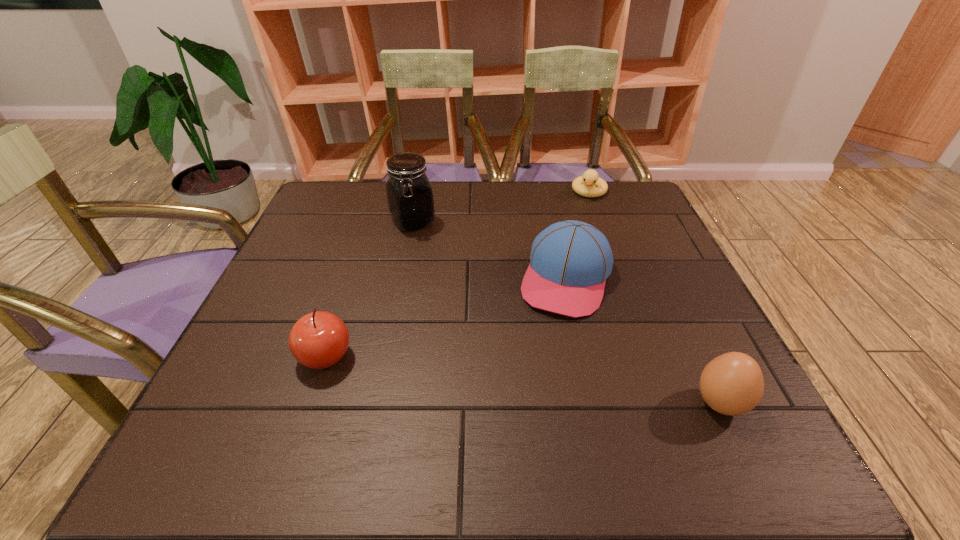
Locate an element on the screen. vacant spot on the desktop that is between the apple and the boiled egg and is positioned on the front-facing side of the baseball cap is located at coordinates (531, 381).

Where is `vacant space on the desktop that is between the apple and the boiled egg and is positioned at the beak of the shortest object`? This screenshot has height=540, width=960. vacant space on the desktop that is between the apple and the boiled egg and is positioned at the beak of the shortest object is located at coordinates (526, 381).

This screenshot has height=540, width=960. In order to click on free space on the desktop that is between the apple and the nearest object and is positioned on the lid of the tallest object in this screenshot , I will do `click(555, 384)`.